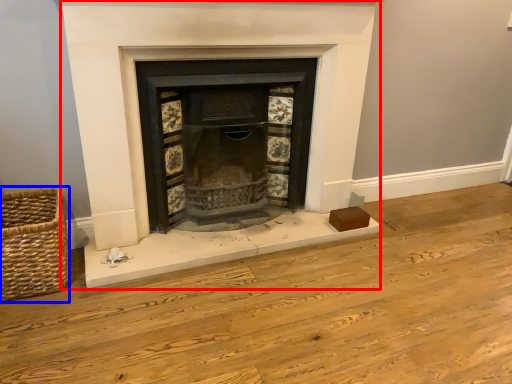
Question: Among these objects, which one is nearest to the camera, fireplace (highlighted by a red box) or basket (highlighted by a blue box)?

Choices:
 (A) fireplace
 (B) basket

Answer: (A)